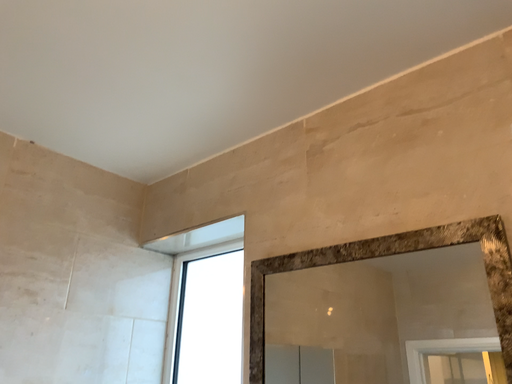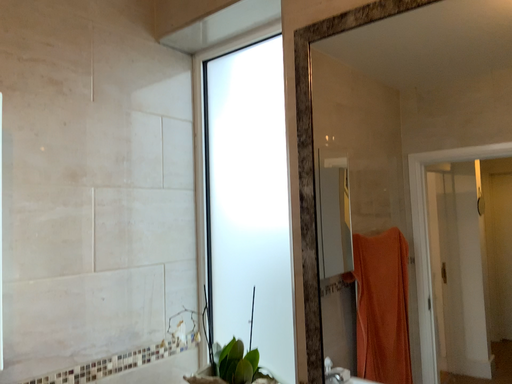
Question: Which way did the camera rotate in the video?

Choices:
 (A) rotated upward
 (B) rotated downward

Answer: (B)